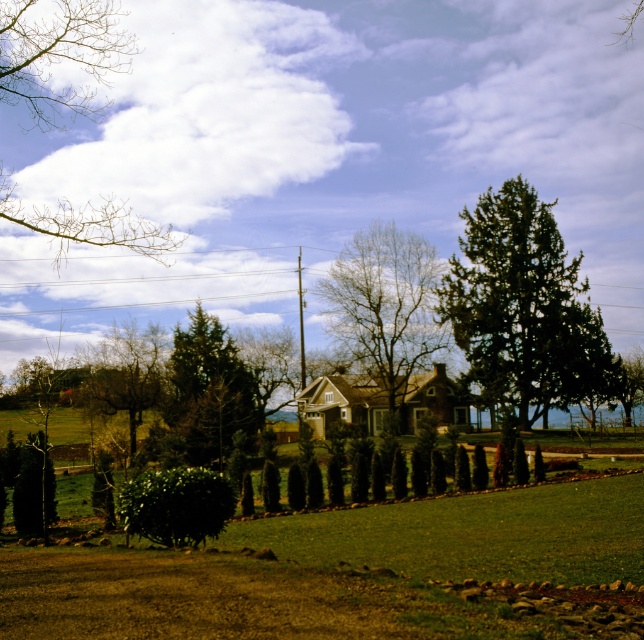
Question: Estimate the real-world distances between objects in this image. Which object is farther from the green leafy tree at center?

Choices:
 (A) green textured tree at center
 (B) green leafy hedge at center
 (C) bare wood tree at center

Answer: (B)

Question: Observing the image, what is the correct spatial positioning of bare wood tree at center in reference to green textured evergreen tree at center?

Choices:
 (A) above
 (B) below

Answer: (A)

Question: Is the position of green textured tree at center more distant than that of green textured evergreen tree at center?

Choices:
 (A) yes
 (B) no

Answer: (A)

Question: Among these points, which one is nearest to the camera?

Choices:
 (A) (392, 385)
 (B) (24, 499)
 (C) (193, 365)
 (D) (135, 477)

Answer: (D)

Question: Considering the relative positions of green textured tree at center and green leafy hedge at center in the image provided, where is green textured tree at center located with respect to green leafy hedge at center?

Choices:
 (A) left
 (B) right

Answer: (B)

Question: Based on their relative distances, which object is farther from the green leafy hedge at center?

Choices:
 (A) bare wood tree at center
 (B) green textured evergreen tree at center

Answer: (A)